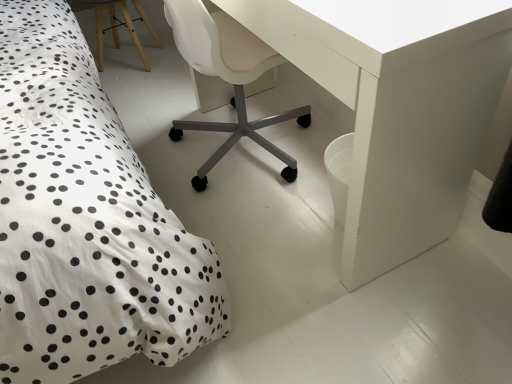
Locate an element on the screen. The width and height of the screenshot is (512, 384). vacant space in front of white glossy table at center is located at coordinates (334, 288).